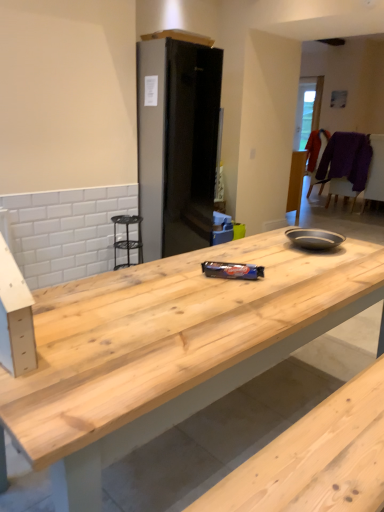
Question: Is purple woolen sweater at right, the 2th chair when ordered from back to front, oriented away from black matte refrigerator at center?

Choices:
 (A) yes
 (B) no

Answer: (A)

Question: Does purple woolen sweater at right, the 2th chair when ordered from back to front, have a lesser height compared to black matte refrigerator at center?

Choices:
 (A) yes
 (B) no

Answer: (A)

Question: From a real-world perspective, is purple woolen sweater at right, the 2th chair when ordered from back to front, located higher than black matte refrigerator at center?

Choices:
 (A) yes
 (B) no

Answer: (B)

Question: Is purple woolen sweater at right, the 2th chair when ordered from back to front, facing towards black matte refrigerator at center?

Choices:
 (A) no
 (B) yes

Answer: (A)

Question: Is purple woolen sweater at right, the 2th chair when ordered from back to front, to the right of black matte refrigerator at center from the viewer's perspective?

Choices:
 (A) yes
 (B) no

Answer: (A)

Question: In the image, is purple woolen sweater at right, which is the 1th chair in front-to-back order, positioned in front of or behind natural wood countertop at center?

Choices:
 (A) behind
 (B) front

Answer: (A)

Question: Based on their positions, is purple woolen sweater at right, the 2th chair when ordered from back to front, located to the left or right of natural wood countertop at center?

Choices:
 (A) left
 (B) right

Answer: (B)

Question: From their relative heights in the image, would you say purple woolen sweater at right, which is the 1th chair in front-to-back order, is taller or shorter than natural wood countertop at center?

Choices:
 (A) short
 (B) tall

Answer: (B)

Question: From the image's perspective, relative to natural wood countertop at center, is purple woolen sweater at right, which is the 1th chair in front-to-back order, above or below?

Choices:
 (A) above
 (B) below

Answer: (A)

Question: Based on their positions, is purple woolen sweater at right, the 2th chair when ordered from back to front, located to the left or right of purple fabric chair at upper right, which is the second chair from front to back?

Choices:
 (A) left
 (B) right

Answer: (B)

Question: Is purple woolen sweater at right, the 2th chair when ordered from back to front, taller or shorter than purple fabric chair at upper right, which is the first chair from back to front?

Choices:
 (A) tall
 (B) short

Answer: (A)

Question: Considering their positions, is purple woolen sweater at right, which is the 1th chair in front-to-back order, located in front of or behind purple fabric chair at upper right, which is the first chair from back to front?

Choices:
 (A) front
 (B) behind

Answer: (A)

Question: Looking at their shapes, would you say purple woolen sweater at right, which is the 1th chair in front-to-back order, is wider or thinner than purple fabric chair at upper right, which is the first chair from back to front?

Choices:
 (A) thin
 (B) wide

Answer: (B)

Question: Considering the positions of purple fabric chair at upper right, which is the second chair from front to back, and black matte refrigerator at center in the image, is purple fabric chair at upper right, which is the second chair from front to back, bigger or smaller than black matte refrigerator at center?

Choices:
 (A) small
 (B) big

Answer: (A)

Question: From the image's perspective, is purple fabric chair at upper right, which is the second chair from front to back, positioned above or below black matte refrigerator at center?

Choices:
 (A) below
 (B) above

Answer: (B)